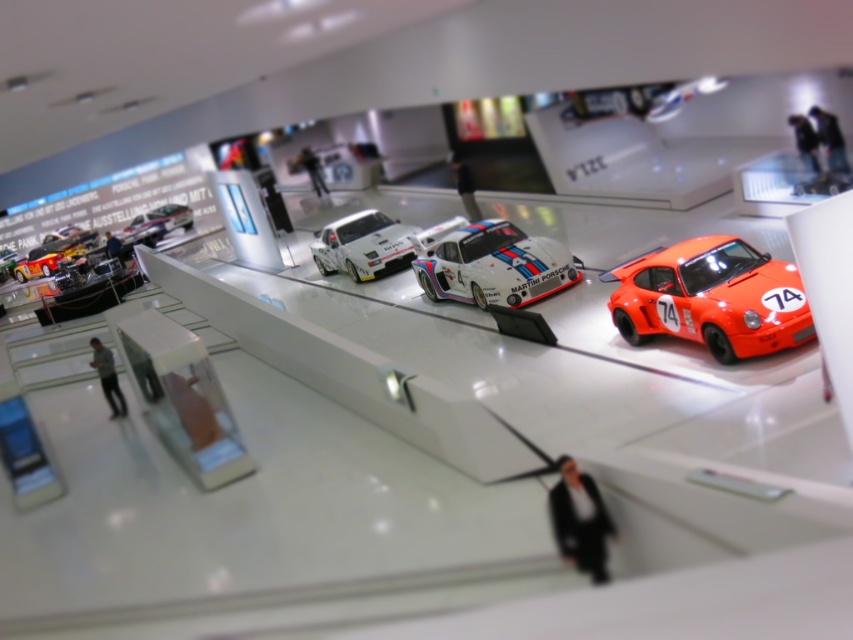
Between white glossy race car at center and metallic silver race car at upper left, which one is positioned higher?

metallic silver race car at upper left is higher up.

Is point (560, 269) farther from viewer compared to point (138, 236)?

No, (560, 269) is in front of (138, 236).

Describe the element at coordinates (492, 266) in the screenshot. Image resolution: width=853 pixels, height=640 pixels. I see `white glossy race car at center` at that location.

This screenshot has width=853, height=640. Identify the location of white glossy race car at center. click(x=492, y=266).

Does orange matte toy car at right have a greater width compared to white glossy race car at center?

Incorrect, orange matte toy car at right's width does not surpass white glossy race car at center's.

Is orange matte toy car at right in front of white glossy race car at center?

Yes, orange matte toy car at right is closer to the viewer.

The width and height of the screenshot is (853, 640). Describe the element at coordinates (711, 298) in the screenshot. I see `orange matte toy car at right` at that location.

Find the location of `orange matte toy car at right`. orange matte toy car at right is located at coordinates (711, 298).

Can you confirm if orange matte toy car at right is smaller than metallic silver race car at upper left?

Incorrect, orange matte toy car at right is not smaller in size than metallic silver race car at upper left.

Between orange matte toy car at right and metallic silver race car at upper left, which one is positioned lower?

orange matte toy car at right

Is point (759, 259) closer to camera compared to point (161, 205)?

Yes.

Where is `orange matte toy car at right`? The width and height of the screenshot is (853, 640). orange matte toy car at right is located at coordinates (711, 298).